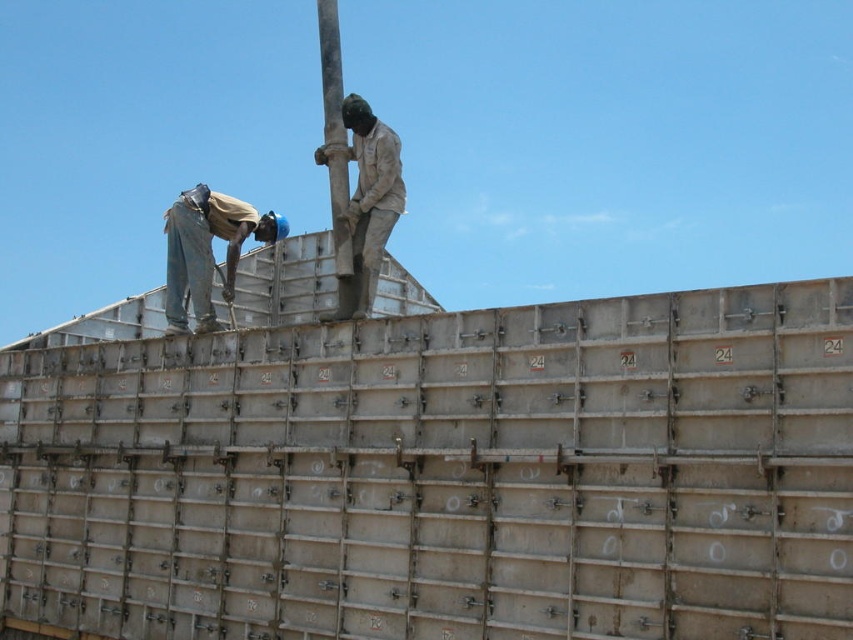
Identify the location of brown denim jeans at upper left. (207, 250).

Does brown denim jeans at upper left appear on the right side of smooth metallic pole at upper center?

Correct, you'll find brown denim jeans at upper left to the right of smooth metallic pole at upper center.

Locate an element on the screen. brown denim jeans at upper left is located at coordinates (207, 250).

Locate an element on the screen. The width and height of the screenshot is (853, 640). brown denim jeans at upper left is located at coordinates (207, 250).

Is dirty beige uniform at center thinner than smooth metallic pole at upper center?

No, dirty beige uniform at center is not thinner than smooth metallic pole at upper center.

This screenshot has width=853, height=640. Describe the element at coordinates (368, 204) in the screenshot. I see `dirty beige uniform at center` at that location.

Describe the element at coordinates (368, 204) in the screenshot. I see `dirty beige uniform at center` at that location.

I want to click on dirty beige uniform at center, so click(x=368, y=204).

Can you confirm if gray metallic panels at upper center is shorter than dirty beige uniform at center?

Indeed, gray metallic panels at upper center has a lesser height compared to dirty beige uniform at center.

Which is in front, point (352, 563) or point (376, 276)?

Point (352, 563) is in front.

The image size is (853, 640). I want to click on gray metallic panels at upper center, so click(444, 474).

Where is `gray metallic panels at upper center`? The image size is (853, 640). gray metallic panels at upper center is located at coordinates (444, 474).